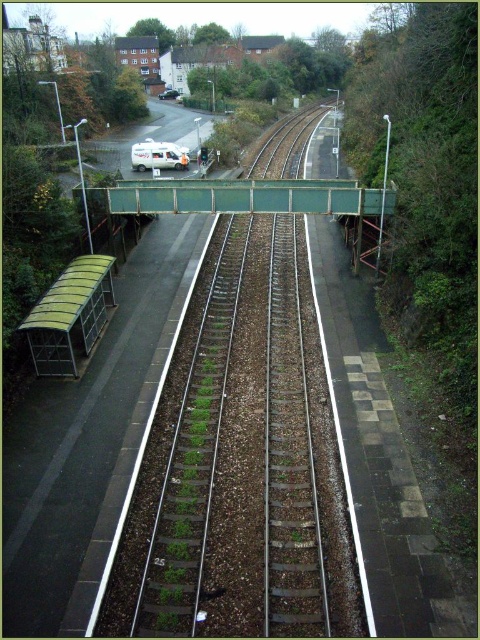
Question: Is green metallic bridge at center behind white matte van at upper center?

Choices:
 (A) yes
 (B) no

Answer: (B)

Question: Does green metallic bridge at center lie behind white matte van at upper center?

Choices:
 (A) no
 (B) yes

Answer: (A)

Question: Does green metallic bridge at center appear on the left side of white matte van at upper center?

Choices:
 (A) yes
 (B) no

Answer: (B)

Question: Which point is closer to the camera?

Choices:
 (A) (141, 148)
 (B) (157, 182)

Answer: (B)